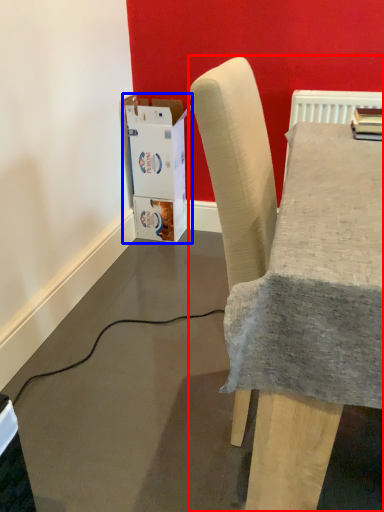
Question: Which object appears farthest to the camera in this image, chair (highlighted by a red box) or cardboard box (highlighted by a blue box)?

Choices:
 (A) chair
 (B) cardboard box

Answer: (B)